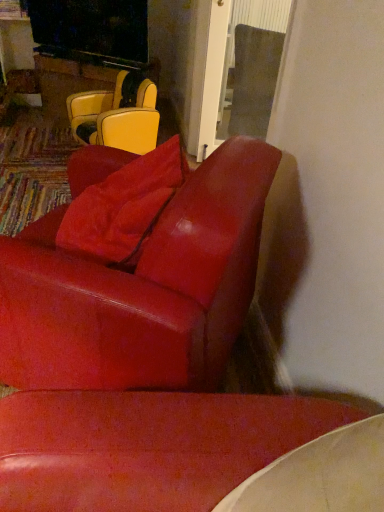
Where is `glossy leather chair at center, which ranks as the second chair in back-to-front order`? The image size is (384, 512). glossy leather chair at center, which ranks as the second chair in back-to-front order is located at coordinates (141, 289).

What do you see at coordinates (116, 117) in the screenshot?
I see `matte yellow leather chair at upper left, the 2th chair from the front` at bounding box center [116, 117].

This screenshot has height=512, width=384. I want to click on suede-like red pillow at upper center, so click(124, 206).

Is matte yellow leather chair at upper left, the first chair viewed from the back, bigger than suede-like red pillow at upper center?

Correct, matte yellow leather chair at upper left, the first chair viewed from the back, is larger in size than suede-like red pillow at upper center.

Is suede-like red pillow at upper center completely or partially inside matte yellow leather chair at upper left, which is the 1th chair in top-to-bottom order?

Definitely not — suede-like red pillow at upper center is not inside matte yellow leather chair at upper left, which is the 1th chair in top-to-bottom order.

You are a GUI agent. You are given a task and a screenshot of the screen. Output one action in this format:
    pyautogui.click(x=<x>, y=<y>)
    Task: Click on the pillow that appears in front of the matte yellow leather chair at upper left, which is the 1th chair in top-to-bottom order
    This screenshot has width=384, height=512.
    Given the screenshot: What is the action you would take?
    pyautogui.click(x=124, y=206)

What's the angular difference between glossy leather chair at center, which ranks as the second chair in back-to-front order, and matte yellow leather chair at upper left, the second chair from the bottom,'s facing directions?

There is a 61.4-degree angle between the facing directions of glossy leather chair at center, which ranks as the second chair in back-to-front order, and matte yellow leather chair at upper left, the second chair from the bottom.

Considering the sizes of objects glossy leather chair at center, which is counted as the 1th chair, starting from the bottom, and matte yellow leather chair at upper left, the first chair viewed from the back, in the image provided, who is wider, glossy leather chair at center, which is counted as the 1th chair, starting from the bottom, or matte yellow leather chair at upper left, the first chair viewed from the back,?

glossy leather chair at center, which is counted as the 1th chair, starting from the bottom.

Between glossy leather chair at center, which is counted as the 1th chair, starting from the bottom, and matte yellow leather chair at upper left, the 2th chair from the front, which one has less height?

matte yellow leather chair at upper left, the 2th chair from the front.

From a real-world perspective, is glossy leather chair at center, which is counted as the 1th chair, starting from the bottom, positioned above or below matte yellow leather chair at upper left, the 2th chair from the front?

In terms of real-world spatial position, glossy leather chair at center, which is counted as the 1th chair, starting from the bottom, is above matte yellow leather chair at upper left, the 2th chair from the front.

Considering the relative sizes of glossy leather chair at center, which ranks as the second chair in back-to-front order, and suede-like red pillow at upper center in the image provided, is glossy leather chair at center, which ranks as the second chair in back-to-front order, smaller than suede-like red pillow at upper center?

Actually, glossy leather chair at center, which ranks as the second chair in back-to-front order, might be larger than suede-like red pillow at upper center.

Is glossy leather chair at center, which is counted as the 1th chair, starting from the bottom, completely or partially outside of suede-like red pillow at upper center?

glossy leather chair at center, which is counted as the 1th chair, starting from the bottom, lies outside suede-like red pillow at upper center's area.

Can you confirm if glossy leather chair at center, which ranks as the second chair in back-to-front order, is shorter than suede-like red pillow at upper center?

Incorrect, the height of glossy leather chair at center, which ranks as the second chair in back-to-front order, does not fall short of that of suede-like red pillow at upper center.

Is suede-like red pillow at upper center positioned before matte yellow leather chair at upper left, which is the 1th chair in top-to-bottom order?

Yes, it is in front of matte yellow leather chair at upper left, which is the 1th chair in top-to-bottom order.

Could you tell me if suede-like red pillow at upper center is turned towards matte yellow leather chair at upper left, the second chair from the bottom?

No, suede-like red pillow at upper center is not oriented towards matte yellow leather chair at upper left, the second chair from the bottom.

Is suede-like red pillow at upper center beside matte yellow leather chair at upper left, which is the 1th chair in top-to-bottom order?

suede-like red pillow at upper center is not next to matte yellow leather chair at upper left, which is the 1th chair in top-to-bottom order, and they're not touching.

Is suede-like red pillow at upper center completely or partially outside of matte yellow leather chair at upper left, which is the 1th chair in top-to-bottom order?

Yes, suede-like red pillow at upper center is outside of matte yellow leather chair at upper left, which is the 1th chair in top-to-bottom order.

From a real-world perspective, does suede-like red pillow at upper center stand above glossy leather chair at center, the first chair positioned from the front?

Yes.

Does suede-like red pillow at upper center have a smaller size compared to glossy leather chair at center, which is counted as the 1th chair, starting from the bottom?

Yes, suede-like red pillow at upper center is smaller than glossy leather chair at center, which is counted as the 1th chair, starting from the bottom.

Is suede-like red pillow at upper center outside of glossy leather chair at center, the first chair positioned from the front?

No, suede-like red pillow at upper center is not outside of glossy leather chair at center, the first chair positioned from the front.

From a real-world perspective, is matte yellow leather chair at upper left, which is the 1th chair in top-to-bottom order, located higher than glossy leather chair at center, which ranks as the second chair in back-to-front order?

No, from a real-world perspective, matte yellow leather chair at upper left, which is the 1th chair in top-to-bottom order, is not over glossy leather chair at center, which ranks as the second chair in back-to-front order

Considering the positions of objects matte yellow leather chair at upper left, the first chair viewed from the back, and glossy leather chair at center, the first chair positioned from the front, in the image provided, who is more to the left, matte yellow leather chair at upper left, the first chair viewed from the back, or glossy leather chair at center, the first chair positioned from the front,?

From the viewer's perspective, matte yellow leather chair at upper left, the first chair viewed from the back, appears more on the left side.

Which of these two, matte yellow leather chair at upper left, the 2th chair from the front, or glossy leather chair at center, which ranks as the second chair in back-to-front order, stands shorter?

Standing shorter between the two is matte yellow leather chair at upper left, the 2th chair from the front.

I want to click on pillow on the right of matte yellow leather chair at upper left, the first chair viewed from the back, so click(x=124, y=206).

Where is `chair that appears in front of the matte yellow leather chair at upper left, the 2th chair from the front`? chair that appears in front of the matte yellow leather chair at upper left, the 2th chair from the front is located at coordinates (141, 289).

Considering their positions, is glossy leather chair at center, which ranks as the second chair in back-to-front order, positioned further to matte yellow leather chair at upper left, the 2th chair from the front, than suede-like red pillow at upper center?

The object further to matte yellow leather chair at upper left, the 2th chair from the front, is glossy leather chair at center, which ranks as the second chair in back-to-front order.

Which object lies further to the anchor point glossy leather chair at center, which is counted as the 1th chair, starting from the bottom, matte yellow leather chair at upper left, which is the 1th chair in top-to-bottom order, or suede-like red pillow at upper center?

Result: matte yellow leather chair at upper left, which is the 1th chair in top-to-bottom order, lies further to glossy leather chair at center, which is counted as the 1th chair, starting from the bottom, than the other object.

From the image, which object appears to be nearer to suede-like red pillow at upper center, matte yellow leather chair at upper left, the second chair from the bottom, or glossy leather chair at center, which is counted as the 1th chair, starting from the bottom?

glossy leather chair at center, which is counted as the 1th chair, starting from the bottom, is closer to suede-like red pillow at upper center.

When comparing their distances from suede-like red pillow at upper center, does glossy leather chair at center, the first chair positioned from the front, or matte yellow leather chair at upper left, the second chair from the bottom, seem closer?

glossy leather chair at center, the first chair positioned from the front, is positioned closer to the anchor suede-like red pillow at upper center.

When comparing their distances from matte yellow leather chair at upper left, which is the 1th chair in top-to-bottom order, does suede-like red pillow at upper center or glossy leather chair at center, which is counted as the 1th chair, starting from the bottom, seem closer?

suede-like red pillow at upper center is closer to matte yellow leather chair at upper left, which is the 1th chair in top-to-bottom order.

Looking at the image, which one is located closer to glossy leather chair at center, which is counted as the 1th chair, starting from the bottom, suede-like red pillow at upper center or matte yellow leather chair at upper left, which is the 1th chair in top-to-bottom order?

The object closer to glossy leather chair at center, which is counted as the 1th chair, starting from the bottom, is suede-like red pillow at upper center.

Image resolution: width=384 pixels, height=512 pixels. Find the location of `pillow between glossy leather chair at center, the first chair positioned from the front, and matte yellow leather chair at upper left, the second chair from the bottom, along the z-axis`. pillow between glossy leather chair at center, the first chair positioned from the front, and matte yellow leather chair at upper left, the second chair from the bottom, along the z-axis is located at coordinates click(124, 206).